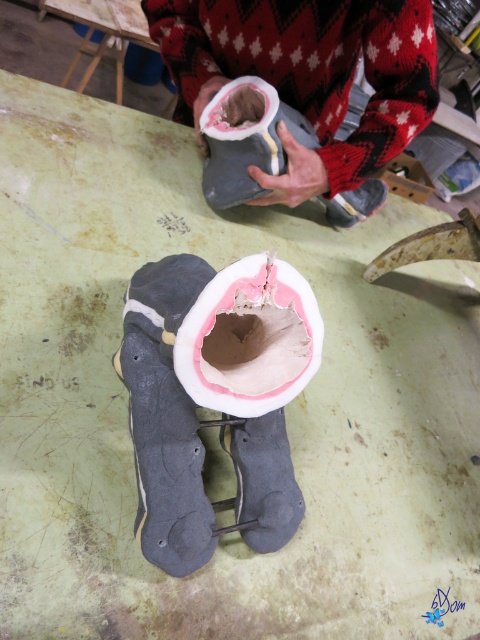
You are an assistant in a pottery studio. You see a matte gray boot at upper center and a pink clay paper plate at center. Which object is positioned higher in the workspace?

The matte gray boot at upper center is positioned higher than the pink clay paper plate at center.

You are an artist working on a sculpture. You have a pink clay paper plate at center and a matte gray boot at center on your workbench. Which object is positioned to the left when viewed from your perspective?

The pink clay paper plate at center is to the left of the matte gray boot at center.

You are an assistant helping someone move items from the workbench. You need to place a heavy object on the closest surface to you. Which object should you choose between the matte gray boot at upper center and the green matte table at upper center?

The matte gray boot at upper center is closer to the viewer than the green matte table at upper center, so you should place the heavy object on the matte gray boot at upper center as it is nearer.